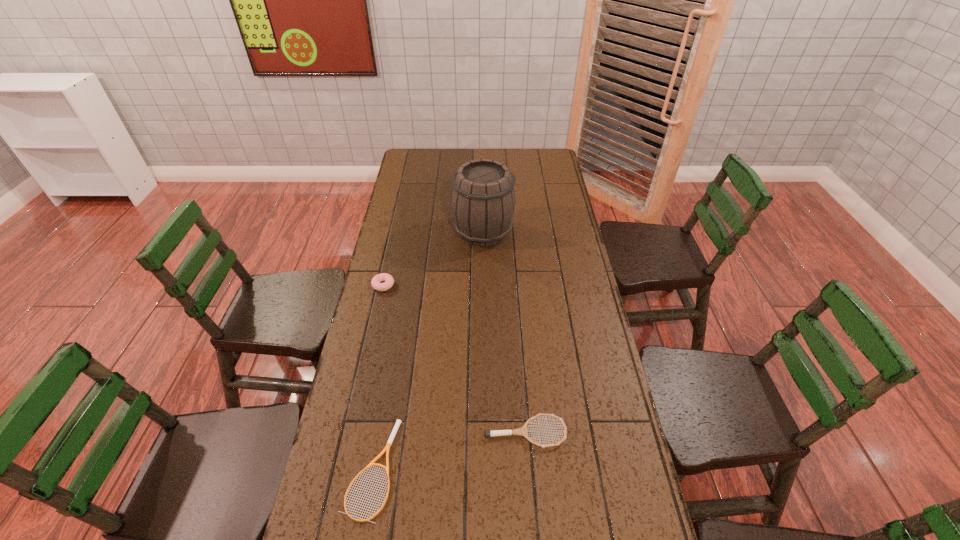
Locate an element on the screen. The width and height of the screenshot is (960, 540). free space located on the front of the right tennis racket is located at coordinates (530, 486).

You are a GUI agent. You are given a task and a screenshot of the screen. Output one action in this format:
    pyautogui.click(x=<x>, y=<y>)
    Task: Click on the blank area located 0.290m on the back of the left tennis racket
    
    Given the screenshot: What is the action you would take?
    pyautogui.click(x=395, y=338)

Where is `doughnut that is at the left edge`? Image resolution: width=960 pixels, height=540 pixels. doughnut that is at the left edge is located at coordinates (389, 280).

You are a GUI agent. You are given a task and a screenshot of the screen. Output one action in this format:
    pyautogui.click(x=<x>, y=<y>)
    Task: Click on the tennis racket that is at the left edge
    This screenshot has width=960, height=540.
    Given the screenshot: What is the action you would take?
    398,422

What are the coordinates of `object present at the right edge` in the screenshot? It's located at (522, 431).

At what (x,y) coordinates should I click in order to perform the action: click on vacant space at the far edge of the desktop. Please return your answer as a coordinate pair (x, y). This screenshot has height=540, width=960. Looking at the image, I should click on (504, 153).

The height and width of the screenshot is (540, 960). Find the location of `vacant space at the left edge of the desktop`. vacant space at the left edge of the desktop is located at coordinates (414, 256).

The image size is (960, 540). Find the location of `free point at the right edge`. free point at the right edge is located at coordinates (576, 310).

Find the location of a particular element. This screenshot has height=540, width=960. free location at the far left corner is located at coordinates (405, 169).

This screenshot has height=540, width=960. In order to click on free point at the far right corner in this screenshot , I will do `click(529, 154)`.